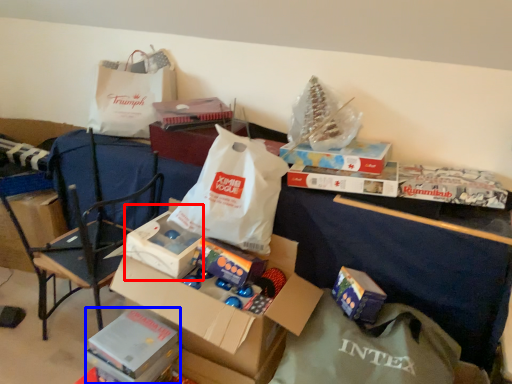
Question: Which of the following is the closest to the observer, storage box (highlighted by a red box) or storage box (highlighted by a blue box)?

Choices:
 (A) storage box
 (B) storage box

Answer: (B)